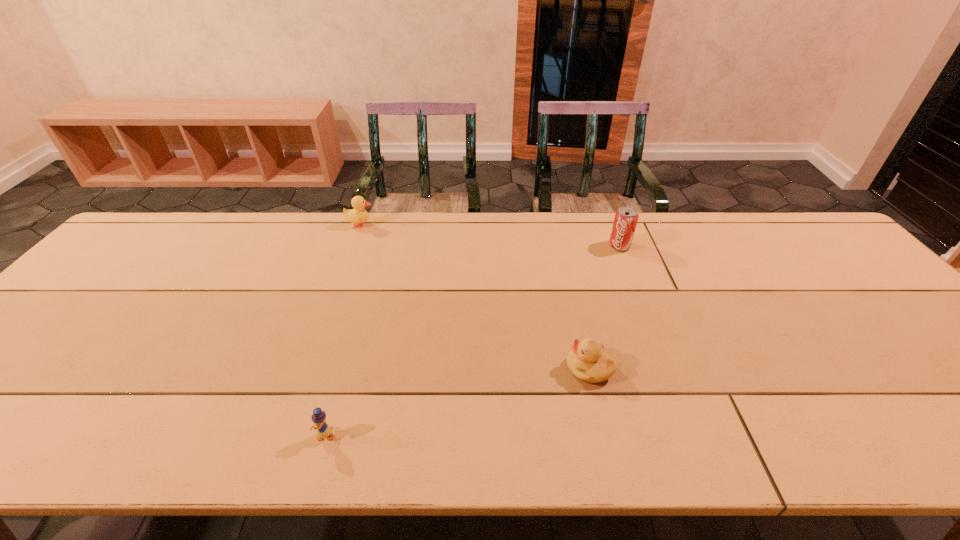
Where is `free space located on the beak of the rightmost duckling`? The width and height of the screenshot is (960, 540). free space located on the beak of the rightmost duckling is located at coordinates (517, 369).

Locate an element on the screen. vacant space located on the beak of the rightmost duckling is located at coordinates (451, 369).

At what (x,y) coordinates should I click in order to perform the action: click on free region located 0.190m on the beak of the rightmost duckling. Please return your answer as a coordinate pair (x, y). The width and height of the screenshot is (960, 540). Looking at the image, I should click on (x=482, y=369).

The height and width of the screenshot is (540, 960). I want to click on soda can at the far edge, so click(x=626, y=217).

Where is `duckling present at the far edge`? The width and height of the screenshot is (960, 540). duckling present at the far edge is located at coordinates (359, 215).

Locate an element on the screen. This screenshot has width=960, height=540. object that is at the near edge is located at coordinates (323, 430).

In the image, there is a desktop. At what (x,y) coordinates should I click in order to perform the action: click on blank space at the far edge. Please return your answer as a coordinate pair (x, y). This screenshot has width=960, height=540. Looking at the image, I should click on (296, 217).

In the image, there is a desktop. At what (x,y) coordinates should I click in order to perform the action: click on blank space at the near edge. Please return your answer as a coordinate pair (x, y). The image size is (960, 540). Looking at the image, I should click on (98, 429).

This screenshot has width=960, height=540. I want to click on vacant space at the left edge, so click(x=105, y=287).

Locate an element on the screen. The height and width of the screenshot is (540, 960). vacant area at the right edge is located at coordinates (883, 301).